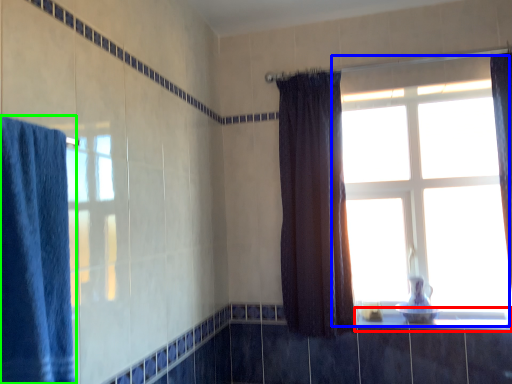
Question: Which is nearer to the window sill (highlighted by a red box)? window (highlighted by a blue box) or curtain (highlighted by a green box).

Choices:
 (A) window
 (B) curtain

Answer: (A)